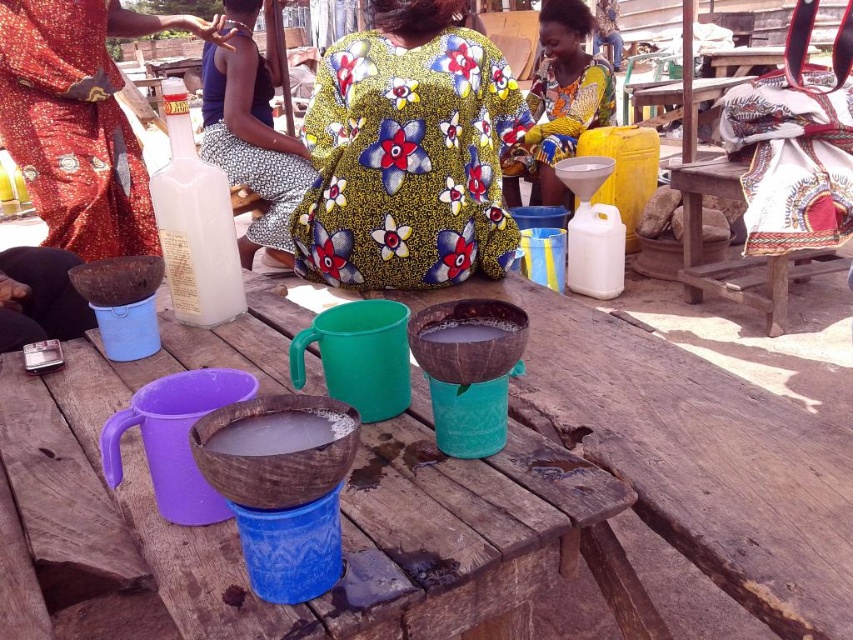
Is wooden table at center to the right of brown matte bowl at center from the viewer's perspective?

Incorrect, wooden table at center is not on the right side of brown matte bowl at center.

Does wooden table at center lie in front of brown matte bowl at center?

Yes, it is.

The width and height of the screenshot is (853, 640). Describe the element at coordinates (341, 508) in the screenshot. I see `wooden table at center` at that location.

The image size is (853, 640). Find the location of `wooden table at center`. wooden table at center is located at coordinates (x=341, y=508).

How distant is wooden table at center from floral fabric dress at center?

wooden table at center and floral fabric dress at center are 24.02 inches apart.

Is wooden table at center in front of floral fabric dress at center?

Yes, wooden table at center is closer to the viewer.

Who is more forward, (x=405, y=426) or (x=343, y=99)?

Point (x=405, y=426)

Find the location of a particular element. wooden table at center is located at coordinates (341, 508).

Can you confirm if floral fabric dress at center is positioned to the left of floral fabric dress at upper center?

Yes, floral fabric dress at center is to the left of floral fabric dress at upper center.

Between floral fabric dress at center and floral fabric dress at upper center, which one is positioned lower?

floral fabric dress at center

Is point (418, 19) behind point (573, 122)?

No, it is in front of (573, 122).

You are a GUI agent. You are given a task and a screenshot of the screen. Output one action in this format:
    pyautogui.click(x=<x>, y=<y>)
    Task: Click on the floral fabric dress at center
    Image resolution: width=853 pixels, height=640 pixels.
    Given the screenshot: What is the action you would take?
    pyautogui.click(x=408, y=154)